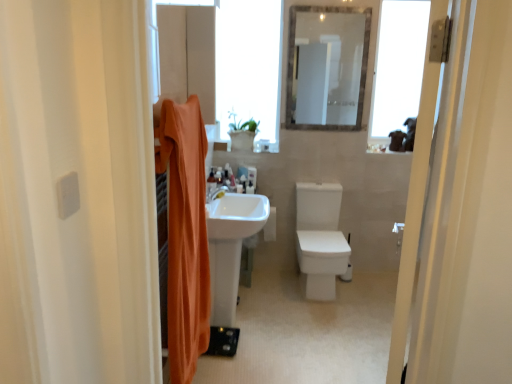
Question: From a real-world perspective, is clear glass mirror at upper center below white glossy sink at center?

Choices:
 (A) no
 (B) yes

Answer: (A)

Question: Does clear glass mirror at upper center lie in front of white glossy sink at center?

Choices:
 (A) yes
 (B) no

Answer: (B)

Question: Considering the relative positions of clear glass mirror at upper center and white glossy sink at center in the image provided, is clear glass mirror at upper center to the left of white glossy sink at center from the viewer's perspective?

Choices:
 (A) yes
 (B) no

Answer: (B)

Question: Are clear glass mirror at upper center and white glossy sink at center located far from each other?

Choices:
 (A) no
 (B) yes

Answer: (B)

Question: From the image's perspective, is clear glass mirror at upper center under white glossy sink at center?

Choices:
 (A) no
 (B) yes

Answer: (A)

Question: Is translucent plastic bottle at center, which is counted as the second toiletry, starting from the right, in front of or behind translucent plastic bottle at center, the 1th toiletry when ordered from left to right, in the image?

Choices:
 (A) front
 (B) behind

Answer: (B)

Question: In terms of height, does translucent plastic bottle at center, the third toiletry positioned from the front, look taller or shorter compared to translucent plastic bottle at center, the 1th toiletry when ordered from left to right?

Choices:
 (A) short
 (B) tall

Answer: (A)

Question: Would you say translucent plastic bottle at center, arranged as the 1th toiletry when viewed from the back, is to the left or to the right of translucent plastic bottle at center, positioned as the third toiletry in back-to-front order, in the picture?

Choices:
 (A) left
 (B) right

Answer: (B)

Question: Considering the positions of point (221, 167) and point (214, 180), is point (221, 167) closer or farther from the camera than point (214, 180)?

Choices:
 (A) closer
 (B) farther

Answer: (B)

Question: From a real-world perspective, is white matte toilet paper at center above or below orange fabric shower curtain at left?

Choices:
 (A) below
 (B) above

Answer: (A)

Question: From the image's perspective, is white matte toilet paper at center above or below orange fabric shower curtain at left?

Choices:
 (A) below
 (B) above

Answer: (B)

Question: Would you say white matte toilet paper at center is inside or outside orange fabric shower curtain at left?

Choices:
 (A) inside
 (B) outside

Answer: (B)

Question: Considering the positions of point (267, 235) and point (201, 284), is point (267, 235) closer or farther from the camera than point (201, 284)?

Choices:
 (A) closer
 (B) farther

Answer: (B)

Question: From a real-world perspective, is orange fabric shower curtain at left positioned above or below clear glass mirror at upper center?

Choices:
 (A) above
 (B) below

Answer: (B)

Question: Does point (162, 144) appear closer or farther from the camera than point (316, 112)?

Choices:
 (A) closer
 (B) farther

Answer: (A)